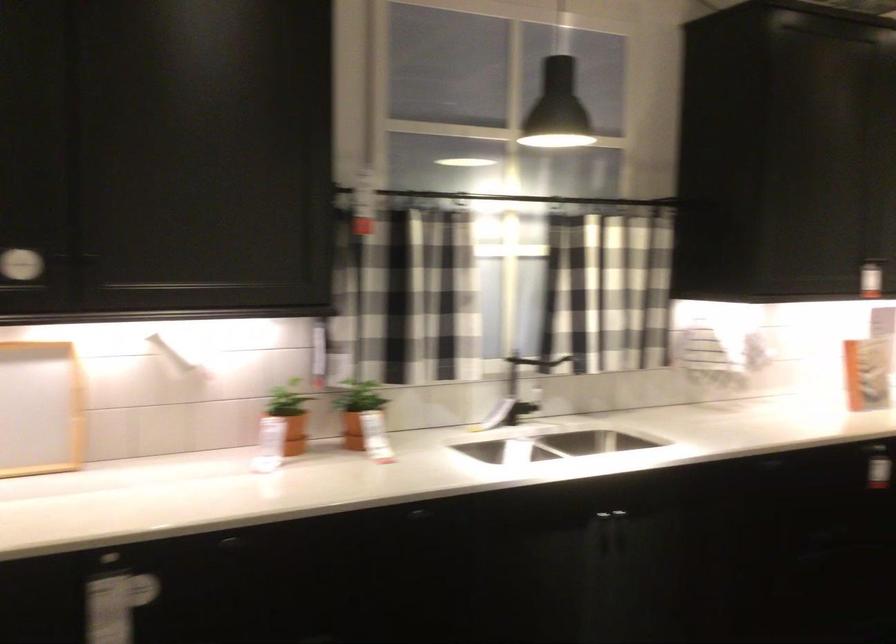
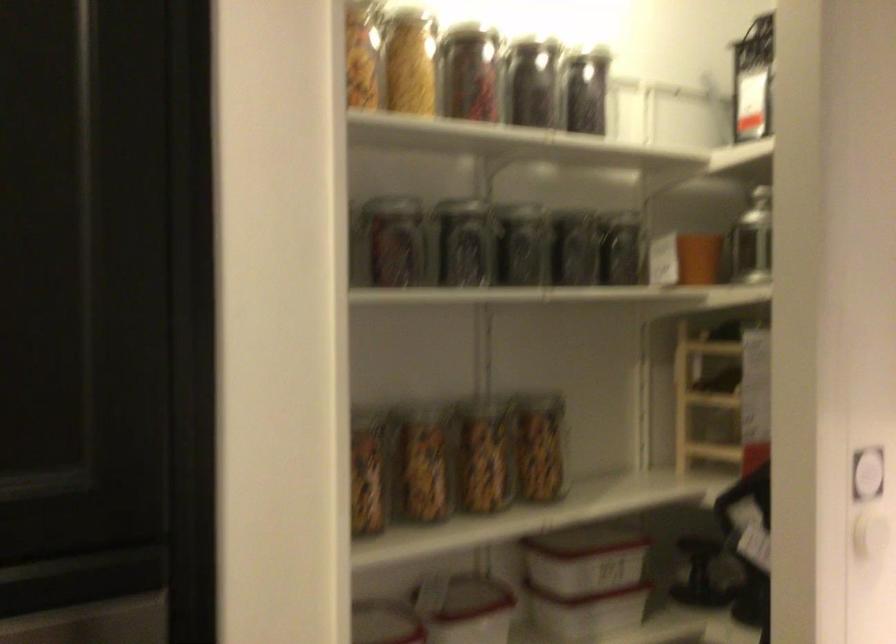
Question: The camera is either moving clockwise (left) or counter-clockwise (right) around the object. The first image is from the beginning of the video and the second image is from the end. Is the camera moving left or right when shooting the video?

Choices:
 (A) Left
 (B) Right

Answer: (B)